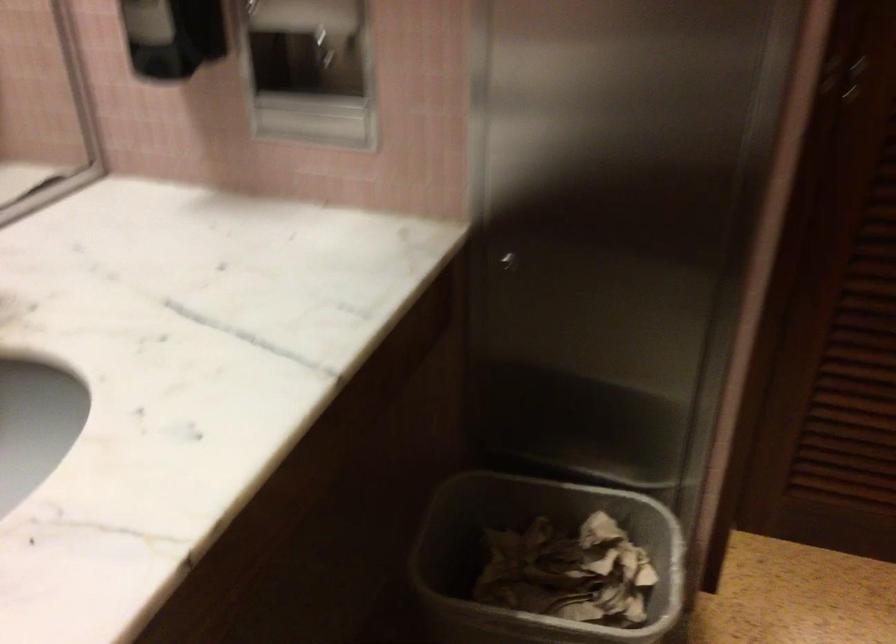
The location [308,71] corresponds to which object?

It refers to a recessed paper towel dispenser.